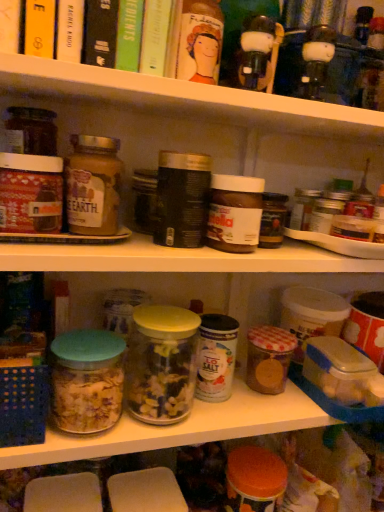
Question: From the image's perspective, is matte plastic jars at upper center, placed as the first shelf when sorted from top to bottom, above or below matte glass jar at left, positioned as the 1th cereal in front-to-back order?

Choices:
 (A) below
 (B) above

Answer: (B)

Question: Considering the positions of matte plastic jars at upper center, placed as the first shelf when sorted from top to bottom, and matte glass jar at left, which appears as the first cereal when viewed from the top, in the image, is matte plastic jars at upper center, placed as the first shelf when sorted from top to bottom, taller or shorter than matte glass jar at left, which appears as the first cereal when viewed from the top,?

Choices:
 (A) short
 (B) tall

Answer: (A)

Question: Estimate the real-world distances between objects in this image. Which object is closer to the hardcover book at upper left, positioned as the second book in left-to-right order?

Choices:
 (A) green matte book at upper center, which appears as the third book when viewed from the left
 (B) clear glass jars at center, placed as the first shelf when sorted from bottom to top
 (C) translucent glass jar filled with cereal at center, the 2th glass jar in the right-to-left sequence
 (D) translucent glass jar of cereal at center, which ranks as the 1th cereal in bottom-to-top order
 (E) green matte book at upper center, which is the 1th book from right to left

Answer: (A)

Question: Estimate the real-world distances between objects in this image. Which object is farther from the green matte book at upper center, which appears as the third book when viewed from the left?

Choices:
 (A) clear glass jars at center, arranged as the second shelf when viewed from the top
 (B) matte plastic jars at upper center, placed as the first shelf when sorted from top to bottom
 (C) translucent glass jar filled with cereal at center, the 2th glass jar in the right-to-left sequence
 (D) hardcover book at upper left, acting as the 3th book starting from the right
 (E) translucent glass jar at center, positioned as the 1th glass jar in right-to-left order

Answer: (A)